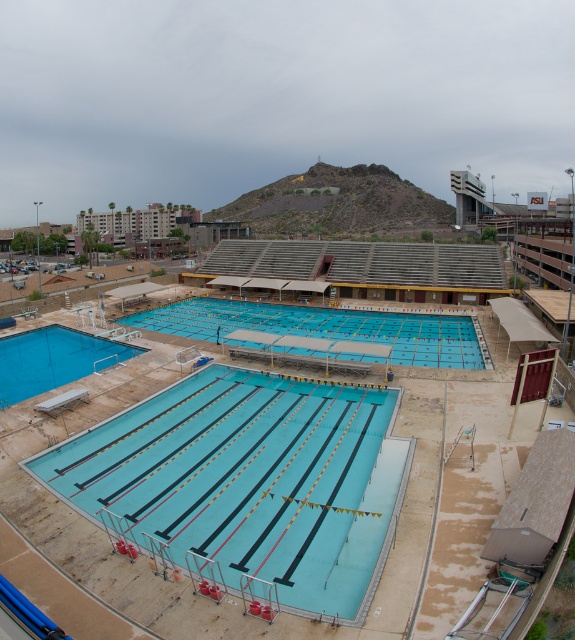
Question: Does clear blue pool at center appear over blue smooth pool at center?

Choices:
 (A) yes
 (B) no

Answer: (B)

Question: Does clear blue pool at center appear under smooth blue pool at bottom left?

Choices:
 (A) no
 (B) yes

Answer: (B)

Question: Which of the following is the closest to the observer?

Choices:
 (A) (427, 326)
 (B) (28, 346)
 (C) (208, 554)

Answer: (C)

Question: Can you confirm if clear blue pool at center is positioned below blue smooth pool at center?

Choices:
 (A) yes
 (B) no

Answer: (A)

Question: Which point is farther to the camera?

Choices:
 (A) 308,529
 (B) 296,326
 (C) 74,332

Answer: (B)

Question: Considering the real-world distances, which object is farthest from the clear blue pool at center?

Choices:
 (A) blue smooth pool at center
 (B) smooth blue pool at bottom left

Answer: (B)